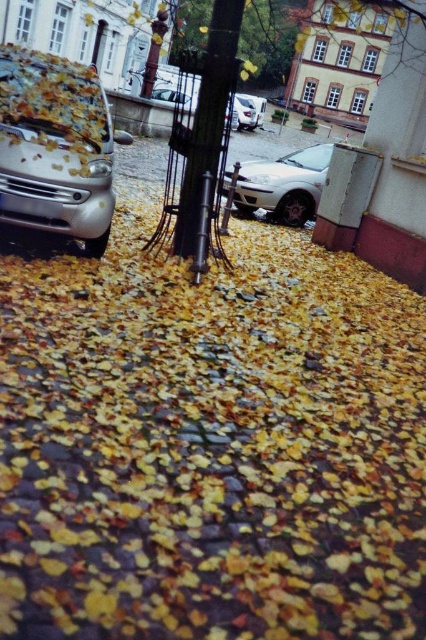
You are standing on the cobblestone pavement covered in autumn leaves and see a point marked at coordinates [54,147]. What object is located at that point?

The point at [54,147] indicates a matte metallic car at left.

You are standing on the cobblestone pavement covered in autumn leaves and see the metallic pole at center and the metallic silver sedan at center. Which object is taller?

The metallic pole at center is taller than the metallic silver sedan at center.